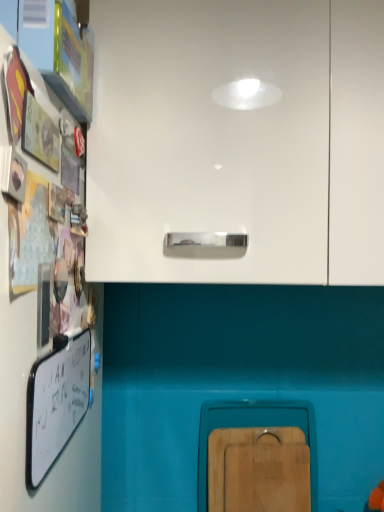
Question: Is whiteboard at left to the right of wooden cutting board at lower center, arranged as the 2th cabinetry when viewed from the top, from the viewer's perspective?

Choices:
 (A) yes
 (B) no

Answer: (B)

Question: Is whiteboard at left thinner than wooden cutting board at lower center, positioned as the second cabinetry in front-to-back order?

Choices:
 (A) yes
 (B) no

Answer: (B)

Question: Is the depth of whiteboard at left less than that of wooden cutting board at lower center, arranged as the 2th cabinetry when viewed from the top?

Choices:
 (A) yes
 (B) no

Answer: (A)

Question: Would you say whiteboard at left is a long distance from wooden cutting board at lower center, arranged as the 2th cabinetry when viewed from the top?

Choices:
 (A) no
 (B) yes

Answer: (A)

Question: Does whiteboard at left touch wooden cutting board at lower center, positioned as the second cabinetry in front-to-back order?

Choices:
 (A) no
 (B) yes

Answer: (A)

Question: From the image's perspective, is whiteboard at left located beneath wooden cutting board at lower center, arranged as the 2th cabinetry when viewed from the top?

Choices:
 (A) yes
 (B) no

Answer: (B)

Question: From a real-world perspective, is whiteboard at left physically below white glossy cabinet at upper center, which is counted as the second cabinetry, starting from the back?

Choices:
 (A) yes
 (B) no

Answer: (A)

Question: Is whiteboard at left smaller than white glossy cabinet at upper center, arranged as the first cabinetry when viewed from the front?

Choices:
 (A) no
 (B) yes

Answer: (B)

Question: From a real-world perspective, is whiteboard at left over white glossy cabinet at upper center, acting as the 1th cabinetry starting from the top?

Choices:
 (A) no
 (B) yes

Answer: (A)

Question: Could you tell me if whiteboard at left is turned towards white glossy cabinet at upper center, which is counted as the second cabinetry, starting from the back?

Choices:
 (A) no
 (B) yes

Answer: (A)

Question: Is whiteboard at left thinner than white glossy cabinet at upper center, acting as the 1th cabinetry starting from the top?

Choices:
 (A) yes
 (B) no

Answer: (A)

Question: From the image's perspective, is whiteboard at left under white glossy cabinet at upper center, acting as the 1th cabinetry starting from the top?

Choices:
 (A) yes
 (B) no

Answer: (A)

Question: Is wooden cutting board at lower center, positioned as the second cabinetry in front-to-back order, far from white glossy cabinet at upper center, which is counted as the second cabinetry, starting from the back?

Choices:
 (A) yes
 (B) no

Answer: (B)